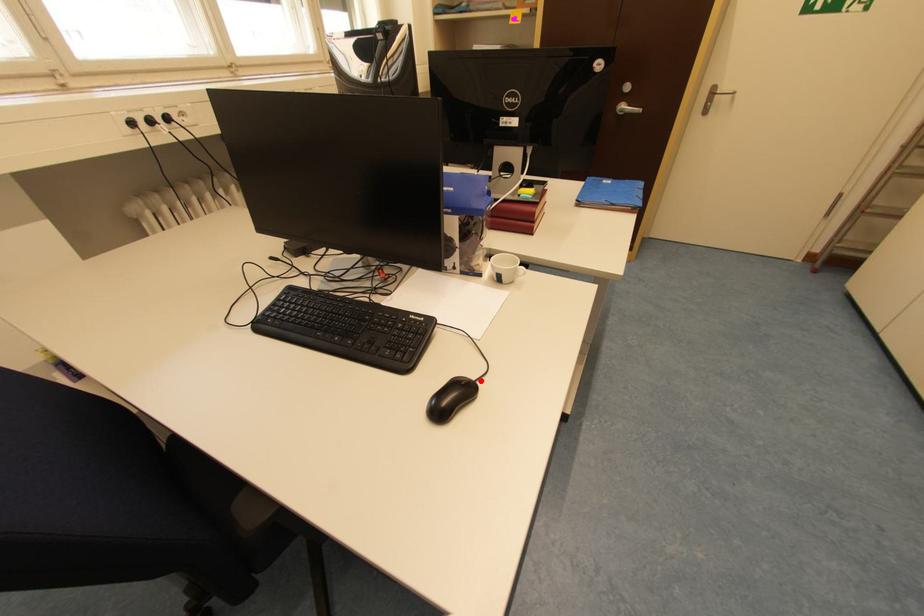
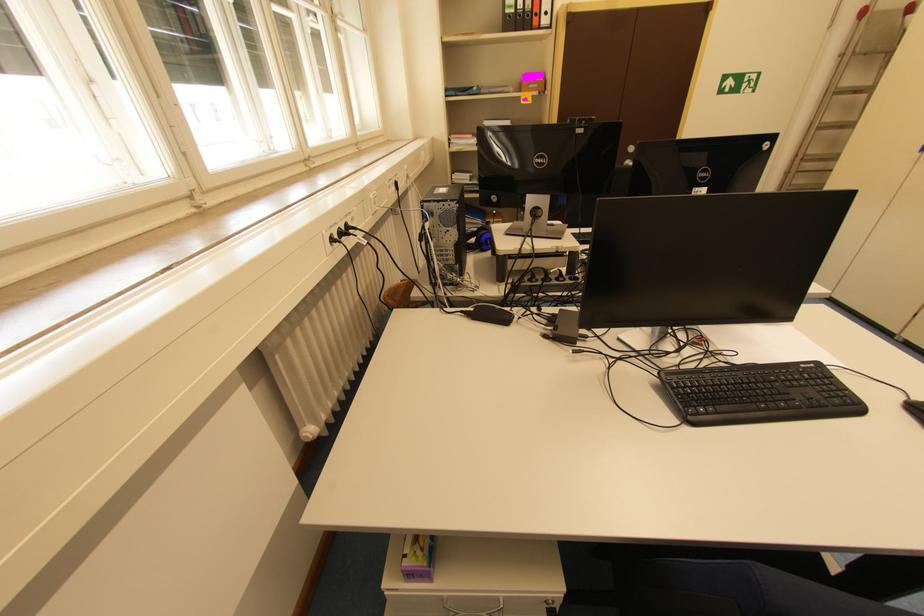
Find the pixel in the second image that matches the highlighted location in the first image.

(915, 400)